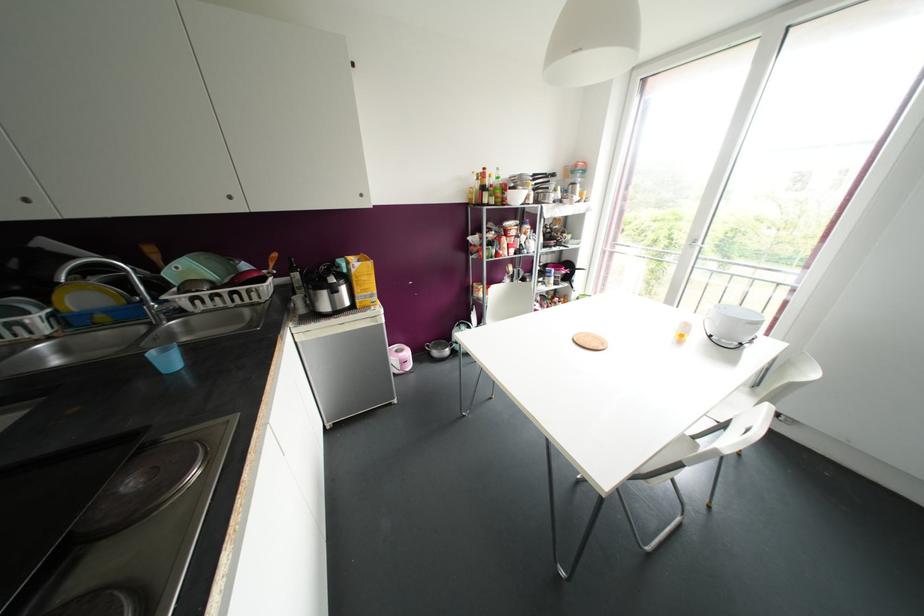
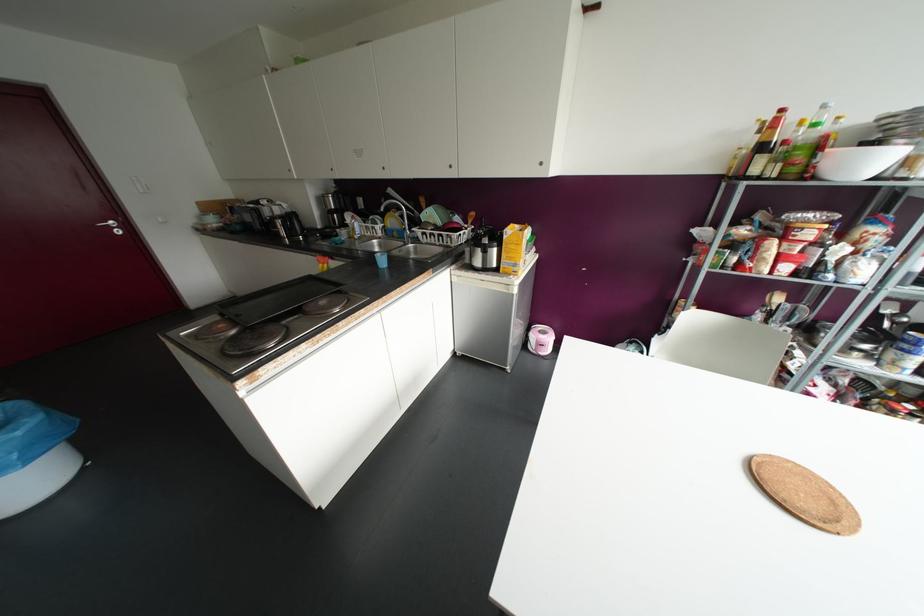
In the second image, find the point that corresponds to point 168,361 in the first image.

(382, 261)